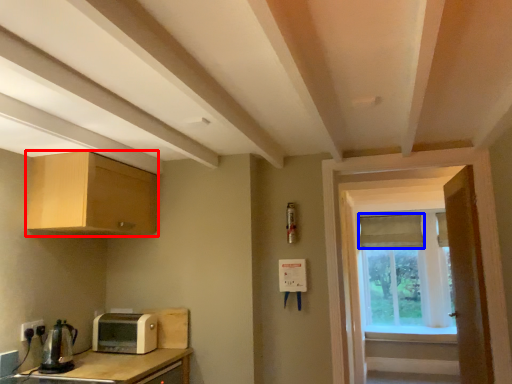
Question: Which of the following is the closest to the observer, cabinetry (highlighted by a red box) or curtain (highlighted by a blue box)?

Choices:
 (A) cabinetry
 (B) curtain

Answer: (A)